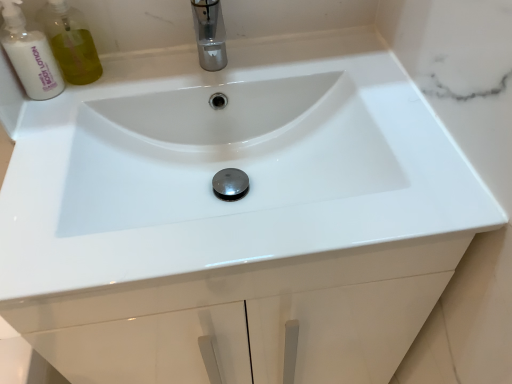
Where is `vacant area that lies between white lotion at upper left and polished chrome tap at upper center`? The image size is (512, 384). vacant area that lies between white lotion at upper left and polished chrome tap at upper center is located at coordinates click(x=134, y=80).